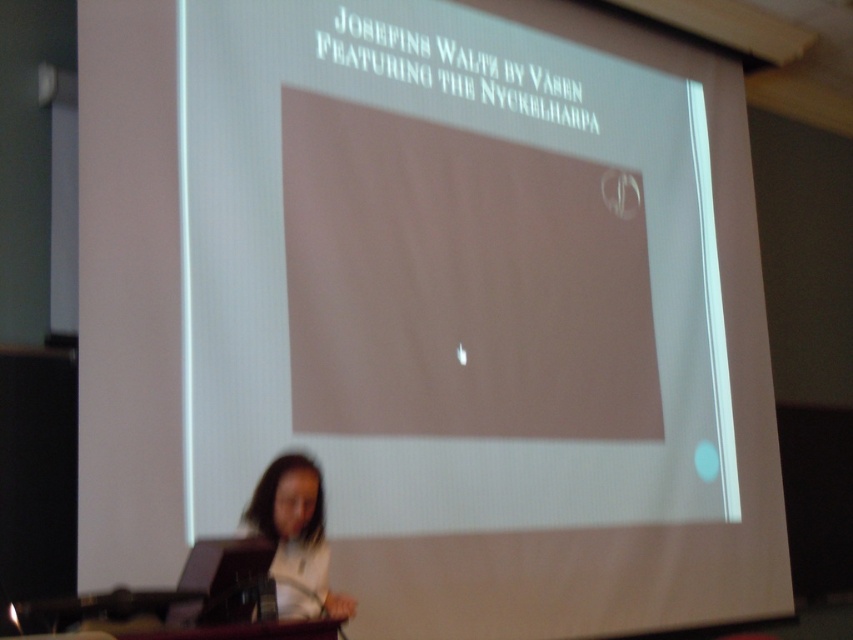
Can you confirm if white matte projection screen at center is positioned to the right of white matte hair at lower left?

Correct, you'll find white matte projection screen at center to the right of white matte hair at lower left.

Is white matte projection screen at center smaller than white matte hair at lower left?

Incorrect, white matte projection screen at center is not smaller in size than white matte hair at lower left.

Image resolution: width=853 pixels, height=640 pixels. What do you see at coordinates (480, 310) in the screenshot?
I see `white matte projection screen at center` at bounding box center [480, 310].

Locate an element on the screen. white matte projection screen at center is located at coordinates (480, 310).